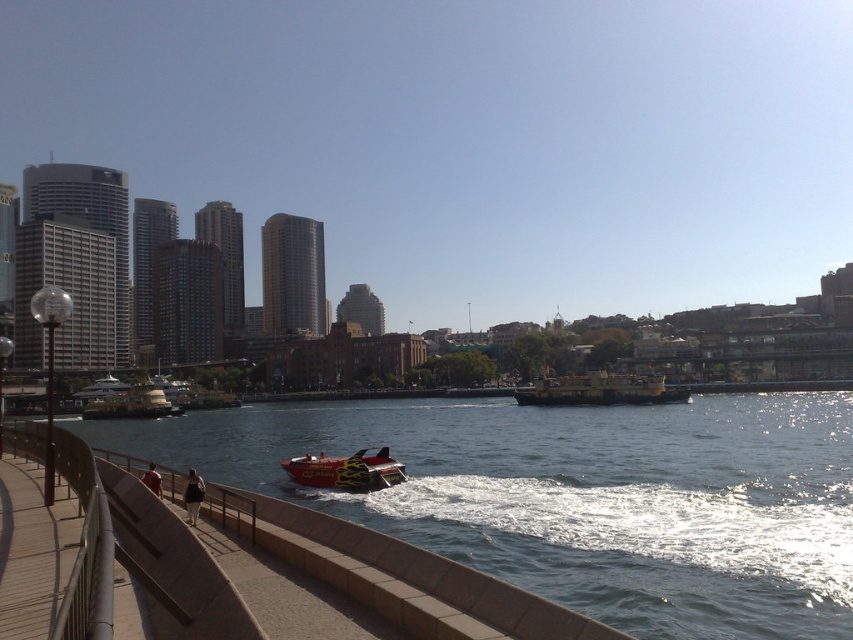
Question: Where is yellow polished ferry at center located in relation to yellow metallic ferry at left in the image?

Choices:
 (A) left
 (B) right

Answer: (B)

Question: Estimate the real-world distances between objects in this image. Which object is farther from the smooth concrete walkway at lower left?

Choices:
 (A) flame-painted fiberglass speedboat at center
 (B) yellow metallic ferry at left
 (C) yellow polished ferry at center

Answer: (B)

Question: Is smooth concrete walkway at lower left above yellow metallic ferry at left?

Choices:
 (A) yes
 (B) no

Answer: (A)

Question: Does yellow polished ferry at center have a larger size compared to yellow metallic ferry at left?

Choices:
 (A) yes
 (B) no

Answer: (A)

Question: Which of the following is the farthest from the observer?

Choices:
 (A) (112, 404)
 (B) (599, 381)
 (C) (293, 474)

Answer: (A)

Question: Among these objects, which one is nearest to the camera?

Choices:
 (A) smooth concrete walkway at lower left
 (B) yellow metallic ferry at left

Answer: (A)